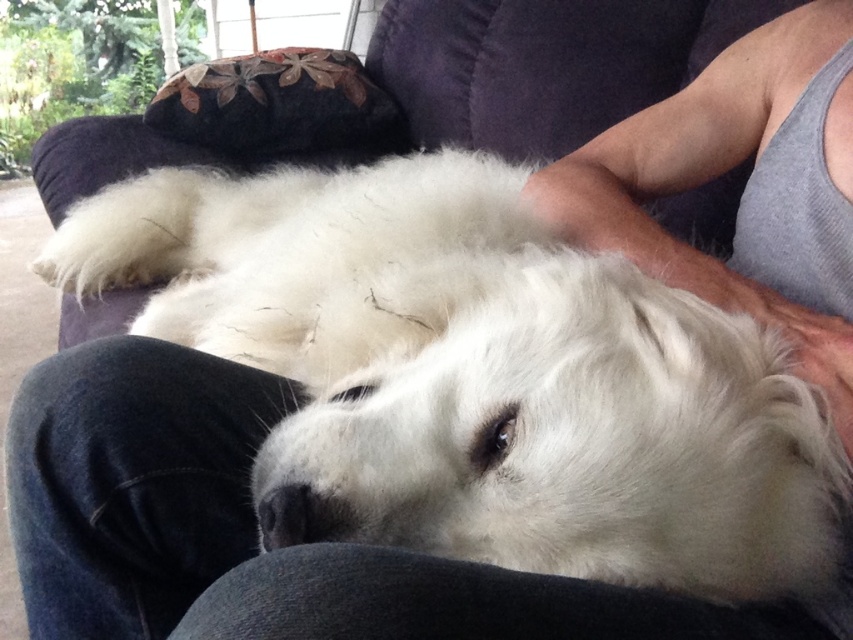
Question: Where is white fluffy dog at center located in relation to gray tank top at upper right in the image?

Choices:
 (A) above
 (B) below

Answer: (B)

Question: Is white fluffy dog at center smaller than gray tank top at upper right?

Choices:
 (A) no
 (B) yes

Answer: (A)

Question: Observing the image, what is the correct spatial positioning of white fluffy dog at center in reference to gray tank top at upper right?

Choices:
 (A) below
 (B) above

Answer: (A)